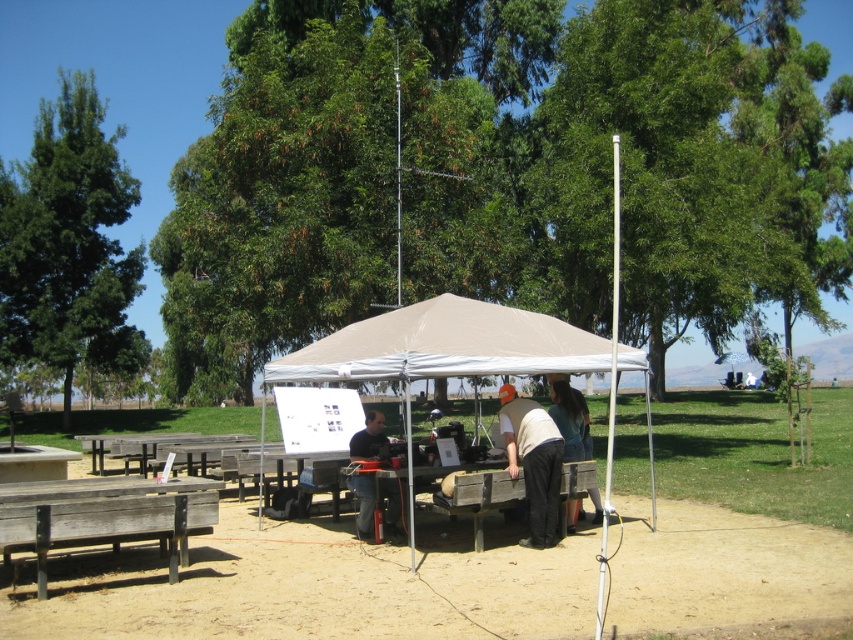
You are standing at the edge of the sandy area and want to take a photo of the dark gray shirt at center and the green leafy tree at upper center. Which object should you frame first in your camera viewfinder to ensure both are in the shot?

The green leafy tree at upper center should be framed first since it is positioned on the left side of the dark gray shirt at center, so starting with the tree ensures both objects are included in the frame.

You are standing at the edge of the sandy area and want to reach the dark green fabric jacket at center without walking through the beige canopy tent. Is there a path available that goes around the green leafy tree at upper center?

The green leafy tree at upper center is further to the viewer than the dark green fabric jacket at center, so the tree is closer to you. This means you can walk around the tree to reach the jacket without going through the tent.

You are standing outside the tent and want to see the person in the dark gray shirt at center. Is the green leafy tree at upper center blocking your view of them?

The green leafy tree at upper center is above the dark gray shirt at center, so it might block part of the view but not entirely since it is positioned above.